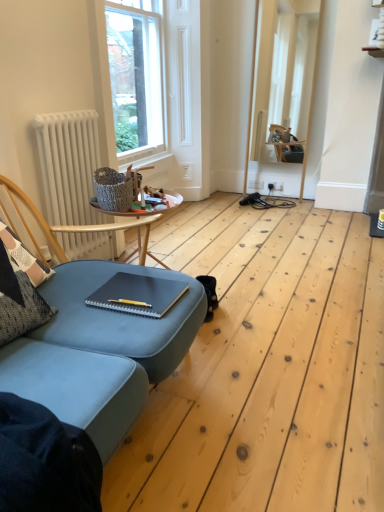
Question: From the image's perspective, is matte black notebook at center over white matte radiator at left?

Choices:
 (A) no
 (B) yes

Answer: (A)

Question: Is matte black notebook at center to the left of white matte radiator at left from the viewer's perspective?

Choices:
 (A) yes
 (B) no

Answer: (B)

Question: Is matte black notebook at center oriented away from white matte radiator at left?

Choices:
 (A) no
 (B) yes

Answer: (A)

Question: Is the position of matte black notebook at center less distant than that of white matte radiator at left?

Choices:
 (A) yes
 (B) no

Answer: (A)

Question: Would you say white matte radiator at left is part of matte black notebook at center's contents?

Choices:
 (A) no
 (B) yes

Answer: (A)

Question: In terms of width, does matte black notebook at center look wider or thinner when compared to clear glass window at upper center?

Choices:
 (A) wide
 (B) thin

Answer: (A)

Question: Would you say matte black notebook at center is to the left or to the right of clear glass window at upper center in the picture?

Choices:
 (A) left
 (B) right

Answer: (B)

Question: Would you say matte black notebook at center is inside or outside clear glass window at upper center?

Choices:
 (A) inside
 (B) outside

Answer: (B)

Question: Considering their positions, is matte black notebook at center located in front of or behind clear glass window at upper center?

Choices:
 (A) front
 (B) behind

Answer: (A)

Question: From a real-world perspective, is white wooden frame at upper center physically located above or below white matte radiator at left?

Choices:
 (A) above
 (B) below

Answer: (A)

Question: Considering the relative positions of white wooden frame at upper center and white matte radiator at left in the image provided, is white wooden frame at upper center to the left or to the right of white matte radiator at left?

Choices:
 (A) left
 (B) right

Answer: (B)

Question: Considering their positions, is white wooden frame at upper center located in front of or behind white matte radiator at left?

Choices:
 (A) front
 (B) behind

Answer: (B)

Question: From their relative heights in the image, would you say white wooden frame at upper center is taller or shorter than white matte radiator at left?

Choices:
 (A) short
 (B) tall

Answer: (B)

Question: From a real-world perspective, relative to matte black notebook at center, is clear glass window at upper center vertically above or below?

Choices:
 (A) below
 (B) above

Answer: (B)

Question: From the image's perspective, is clear glass window at upper center above or below matte black notebook at center?

Choices:
 (A) above
 (B) below

Answer: (A)